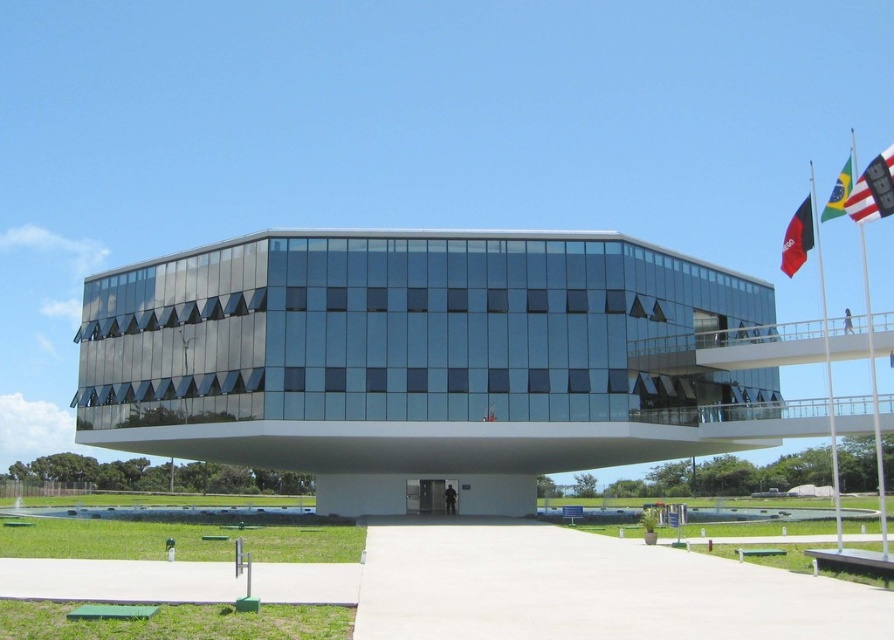
You are standing at the center of the front area of the building. You need to locate the black flagpole at right. In which direction should you look to find it?

The black flagpole at right is located at point (825, 353) in 2D coordinates. Since you are at the center of the front area, you should look towards the right side to find it.

You are an architect designing a new building and want to ensure the flags on the upper right are visually balanced. Given that the white fabric flag at upper right and the black fabric flag at upper right are both present, which flag has a greater width?

The white fabric flag at upper right has a greater width than the black fabric flag at upper right according to the description.

You are standing in front of the modern building and notice a white fabric flag at upper right. What is the exact coordinate of this flag?

The white fabric flag at upper right is located at point (873,189).